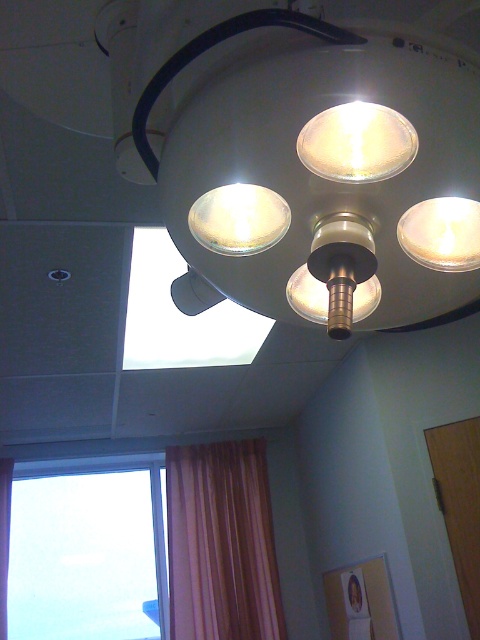
You are a nurse preparing to adjust the surgical lights in the room. You need to locate the matte white lamp at upper center and the matte white light at center. Which one is positioned to the left of the other?

The matte white lamp at upper center is to the left of the matte white light at center.

You are a patient in a hospital room and want to check the time outside by looking through the transparent glass window at lower left and the orange fabric curtain at lower left. Which object is closer to you when you stand in the center of the room?

The transparent glass window at lower left is further to the viewer than orange fabric curtain at lower left, so the orange fabric curtain at lower left is closer to you.

You are a medical professional in the surgical room. You need to locate the point at coordinates (x=357, y=141). Where is this point located?

The point at coordinates (x=357, y=141) is located on the matte white lamp at center.